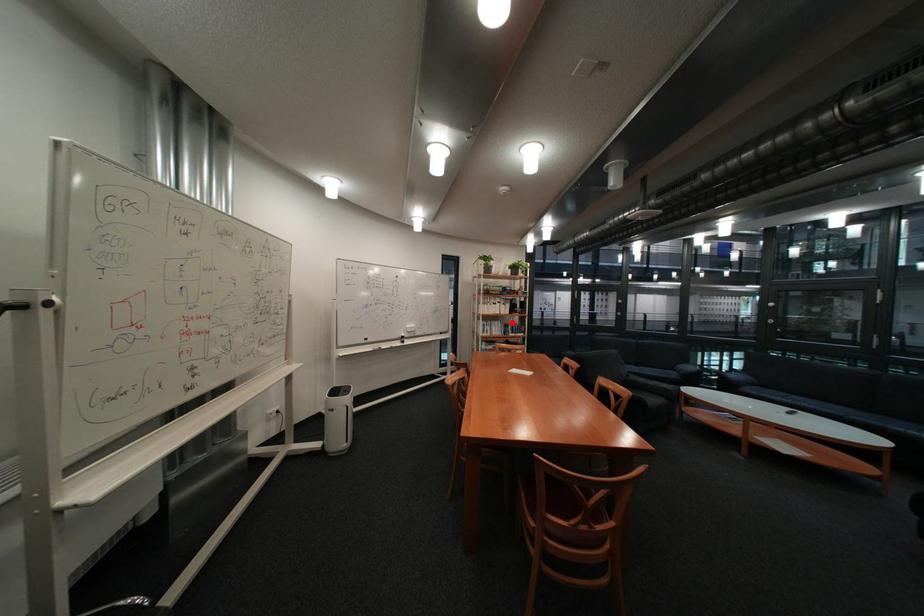
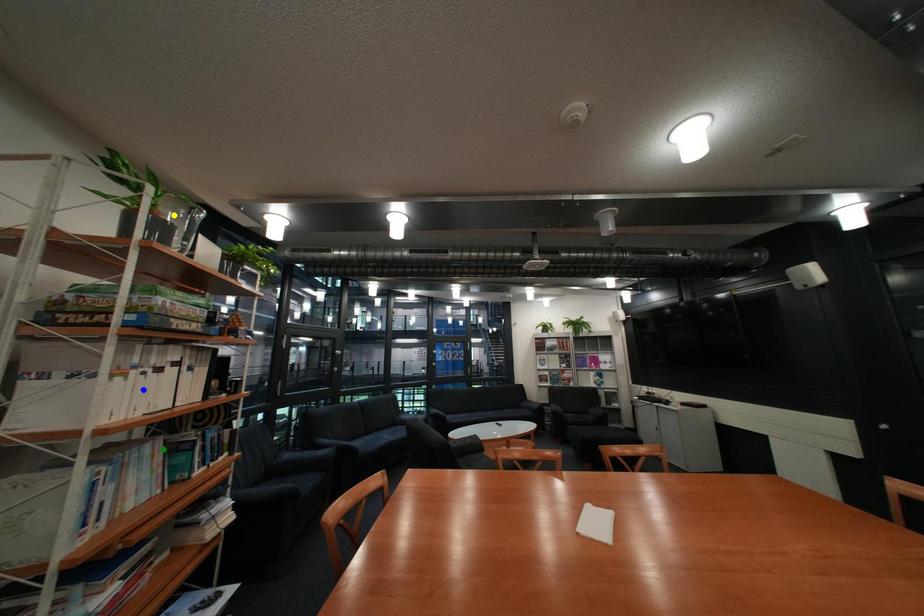
Question: I am providing you with two images of the same scene from different viewpoints. A red point is marked on the first image. You are given multiple points on the second image. Which mark in image 2 goes with the point in image 1?

Choices:
 (A) green point
 (B) blue point
 (C) yellow point

Answer: (A)